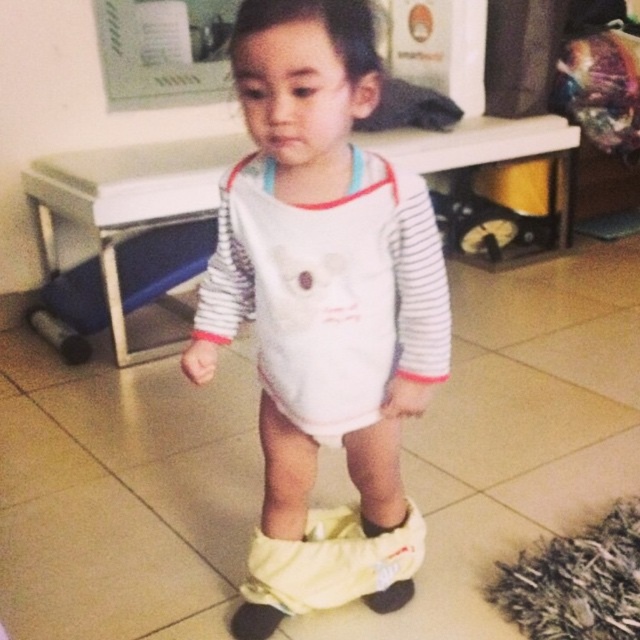
Question: Among these objects, which one is nearest to the camera?

Choices:
 (A) yellow fabric sock at lower center
 (B) white soft bib at center
 (C) black fuzzy sock at lower center
 (D) white soft sock at lower center

Answer: (B)

Question: Estimate the real-world distances between objects in this image. Which object is closer to the white soft onesie at center?

Choices:
 (A) white soft bib at center
 (B) white soft sock at lower center
 (C) black fuzzy sock at lower center
 (D) yellow fabric sock at lower center

Answer: (A)

Question: Among these objects, which one is farthest from the camera?

Choices:
 (A) white soft sock at lower center
 (B) yellow fabric sock at lower center
 (C) white soft bib at center

Answer: (A)

Question: Can you confirm if white soft onesie at center is smaller than yellow fabric sock at lower center?

Choices:
 (A) yes
 (B) no

Answer: (B)

Question: Can you confirm if black fuzzy sock at lower center is positioned to the left of yellow fabric sock at lower center?

Choices:
 (A) yes
 (B) no

Answer: (A)

Question: Is white soft bib at center below yellow fabric sock at lower center?

Choices:
 (A) yes
 (B) no

Answer: (B)